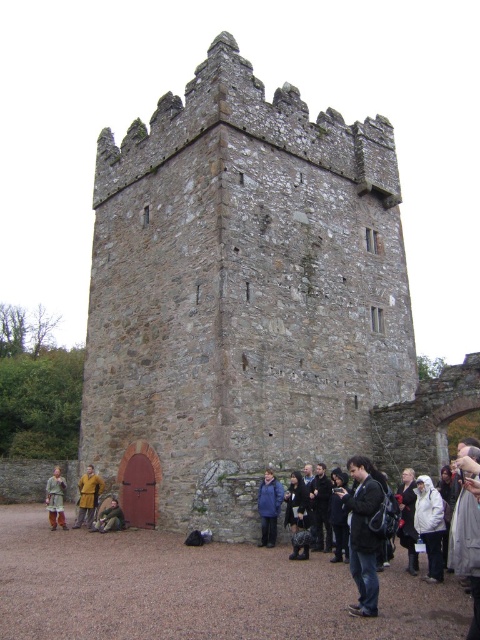
Who is higher up, black leather jacket at lower right or white woolen sweater at lower right?

black leather jacket at lower right

Measure the distance between black leather jacket at lower right and white woolen sweater at lower right.

4.75 meters

Between point (350, 506) and point (409, 497), which one is positioned in front?

Point (350, 506) is more forward.

The width and height of the screenshot is (480, 640). In order to click on black leather jacket at lower right in this screenshot , I will do `click(362, 532)`.

Is black leather jacket at lower right bigger than white fleece jacket at lower right?

Yes.

Does black leather jacket at lower right have a greater width compared to white fleece jacket at lower right?

Yes.

Who is more distant from viewer, (374,499) or (424,531)?

Positioned behind is point (424,531).

Identify the location of black leather jacket at lower right. The image size is (480, 640). (x=362, y=532).

Locate an element on the screen. Image resolution: width=480 pixels, height=640 pixels. stone tower at center is located at coordinates (240, 292).